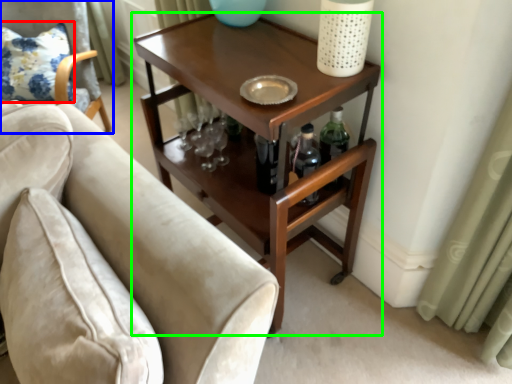
Question: Which is nearer to the pillow (highlighted by a red box)? chair (highlighted by a blue box) or table (highlighted by a green box).

Choices:
 (A) chair
 (B) table

Answer: (A)